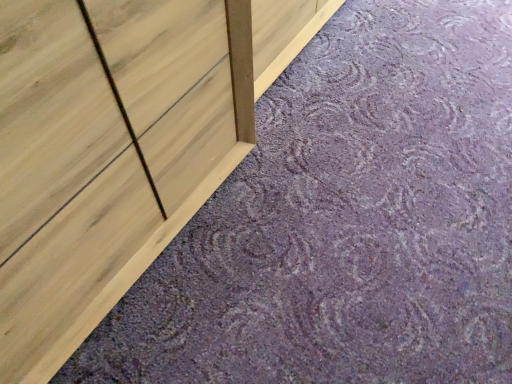
Identify the location of natural wood cupboard at lower right. (118, 146).

What do you see at coordinates (118, 146) in the screenshot? I see `natural wood cupboard at lower right` at bounding box center [118, 146].

What is the approximate height of natural wood cupboard at lower right?

natural wood cupboard at lower right is 1.30 inches in height.

This screenshot has width=512, height=384. In order to click on natural wood cupboard at lower right in this screenshot , I will do `click(118, 146)`.